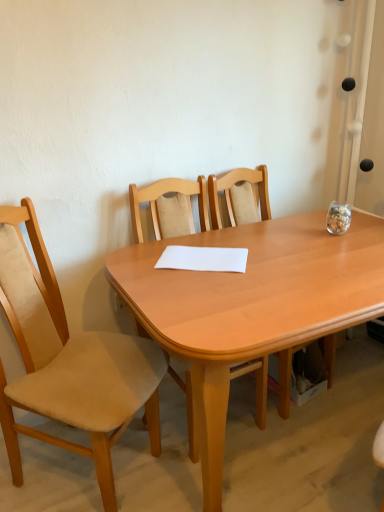
Question: In the image, is wooden chair at center, which is the 3th chair from left to right, positioned in front of or behind light wood chair at center, which is the second chair from right to left?

Choices:
 (A) behind
 (B) front

Answer: (A)

Question: From their relative heights in the image, would you say wooden chair at center, the first chair in the right-to-left sequence, is taller or shorter than light wood chair at center, placed as the 2th chair when sorted from left to right?

Choices:
 (A) short
 (B) tall

Answer: (A)

Question: Based on their relative distances, which object is farther from the wooden chair at center, the first chair in the right-to-left sequence?

Choices:
 (A) light wood table at center
 (B) light wood chair at center, which is the second chair from right to left
 (C) beige fabric chair at left, the first chair when ordered from left to right
 (D) white paper at center

Answer: (C)

Question: Which of these objects is positioned farthest from the light wood table at center?

Choices:
 (A) wooden chair at center, which is the 3th chair from left to right
 (B) white paper at center
 (C) beige fabric chair at left, placed as the third chair when sorted from right to left
 (D) light wood chair at center, which is the second chair from right to left

Answer: (A)